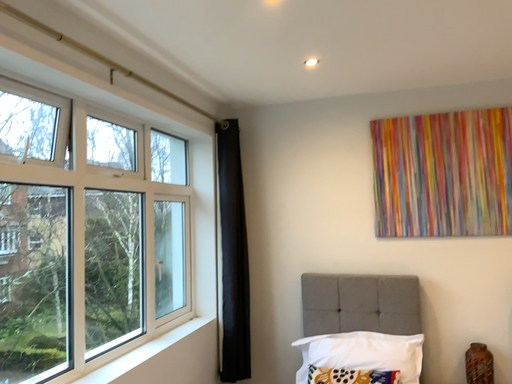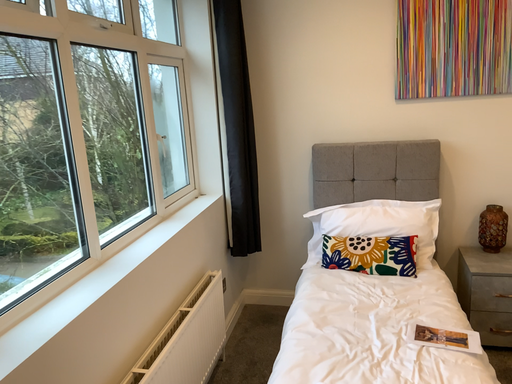
Question: How did the camera likely rotate when shooting the video?

Choices:
 (A) rotated upward
 (B) rotated downward

Answer: (B)